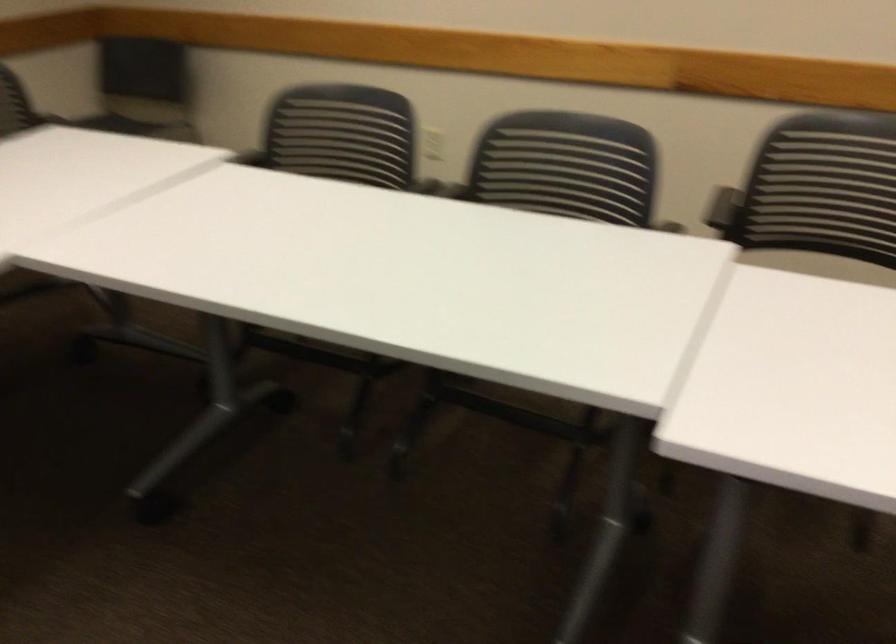
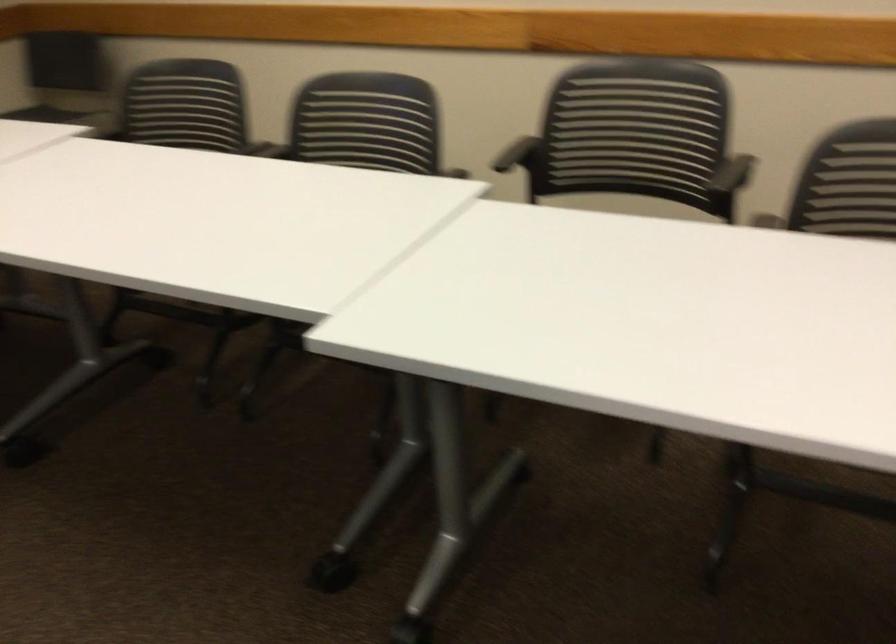
Question: The first image is from the beginning of the video and the second image is from the end. How did the camera likely rotate when shooting the video?

Choices:
 (A) Left
 (B) Right
 (C) Up
 (D) Down

Answer: (D)